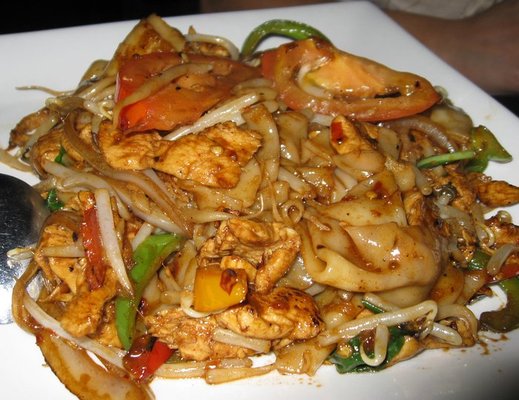
Image resolution: width=519 pixels, height=400 pixels. In order to click on table in this screenshot , I will do `click(374, 24)`.